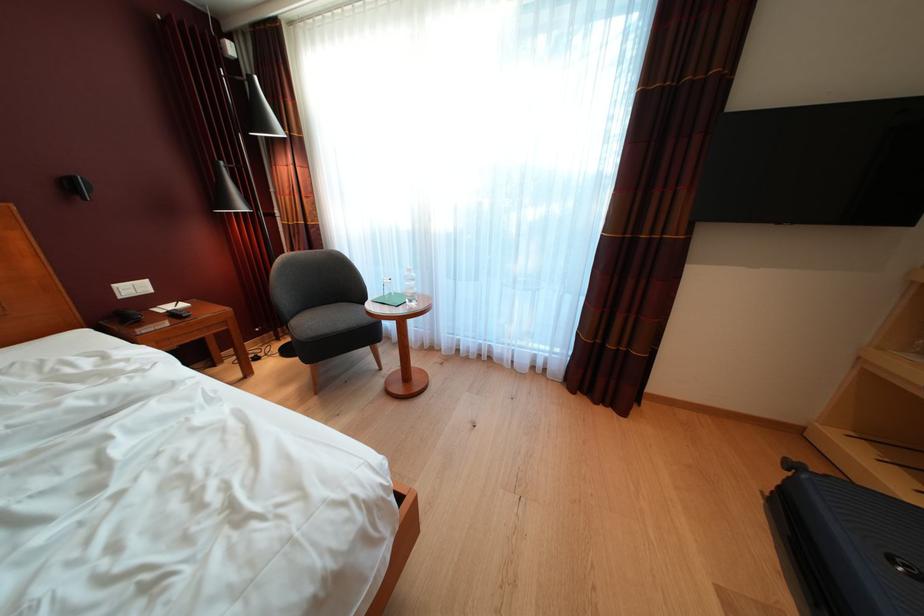
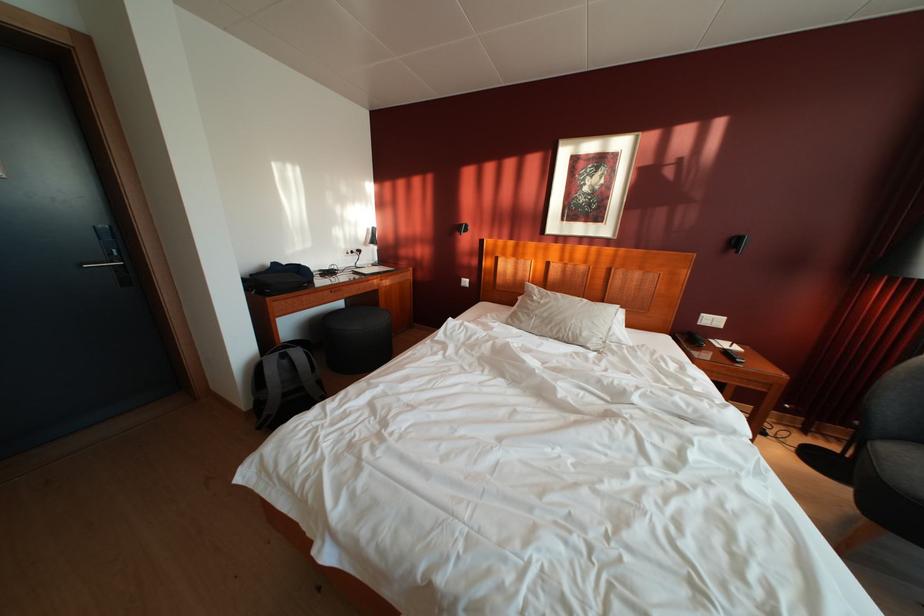
The images are taken continuously from a first-person perspective. In which direction is your viewpoint rotating?

The camera's rotation is toward left-down.